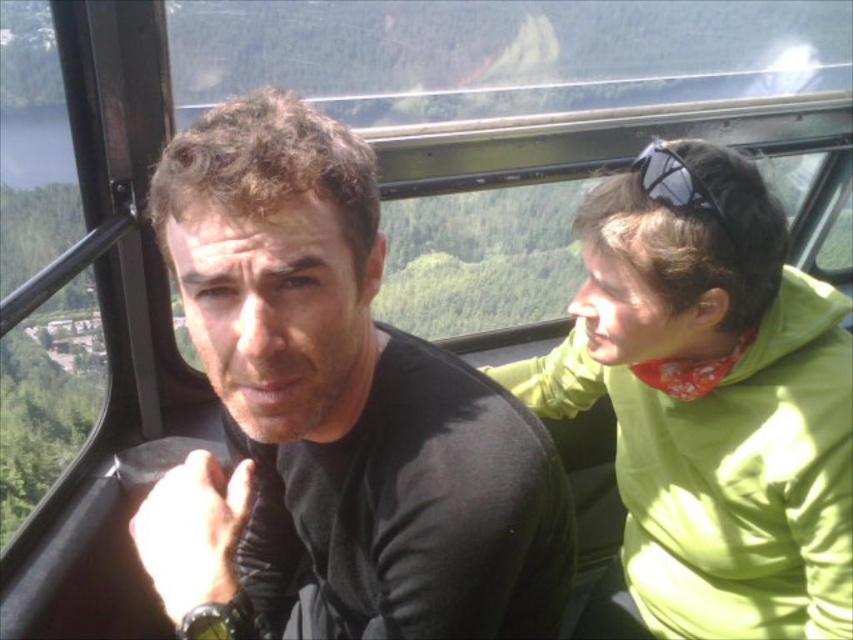
Question: Is black matte shirt at center bigger than green fleece jacket at right?

Choices:
 (A) no
 (B) yes

Answer: (A)

Question: Which object appears farthest from the camera in this image?

Choices:
 (A) black matte shirt at center
 (B) green fleece jacket at right
 (C) black matte sunglasses at upper right

Answer: (B)

Question: Among these objects, which one is farthest from the camera?

Choices:
 (A) black matte shirt at center
 (B) green fleece jacket at right
 (C) black matte sunglasses at upper right

Answer: (B)

Question: Which of the following is the farthest from the observer?

Choices:
 (A) black matte sunglasses at upper right
 (B) green fleece jacket at right

Answer: (B)

Question: Can you confirm if green fleece jacket at right is positioned above black matte sunglasses at upper right?

Choices:
 (A) no
 (B) yes

Answer: (A)

Question: Is black matte shirt at center below green fleece jacket at right?

Choices:
 (A) no
 (B) yes

Answer: (B)